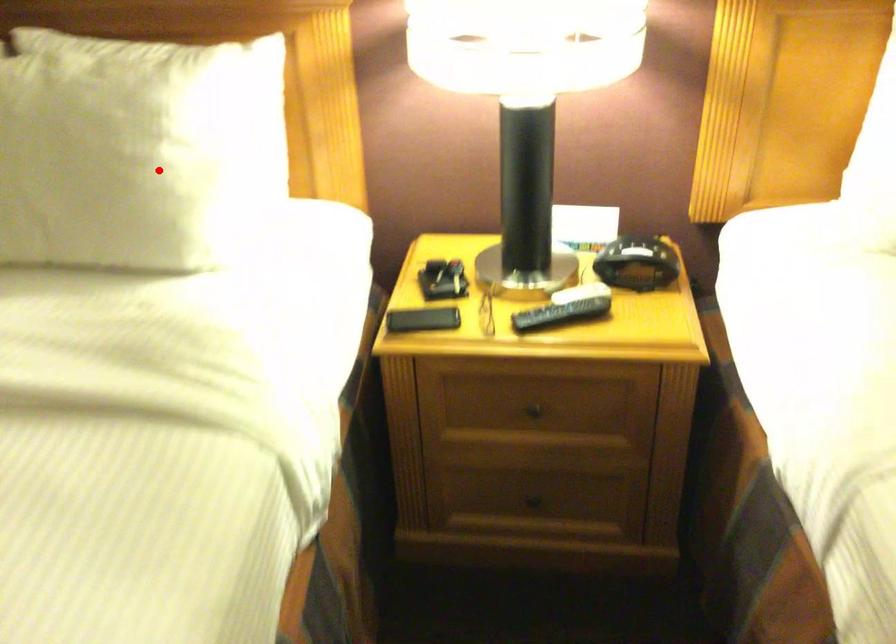
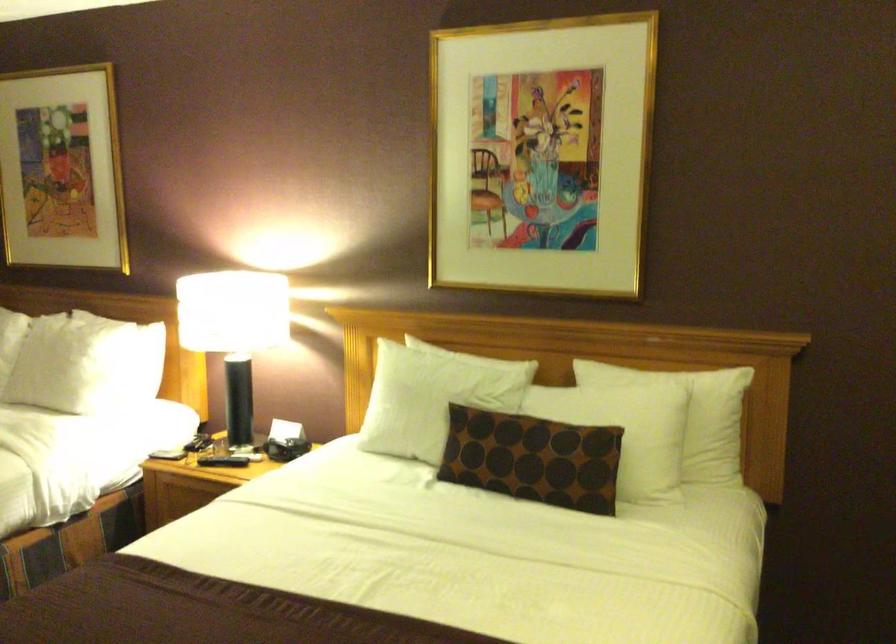
Question: A red point is marked in image1. In image2, is the corresponding 3D point closer to the camera or farther? Reply with the corresponding letter.

Choices:
 (A) The corresponding 3D point is closer.
 (B) The corresponding 3D point is farther.

Answer: (B)